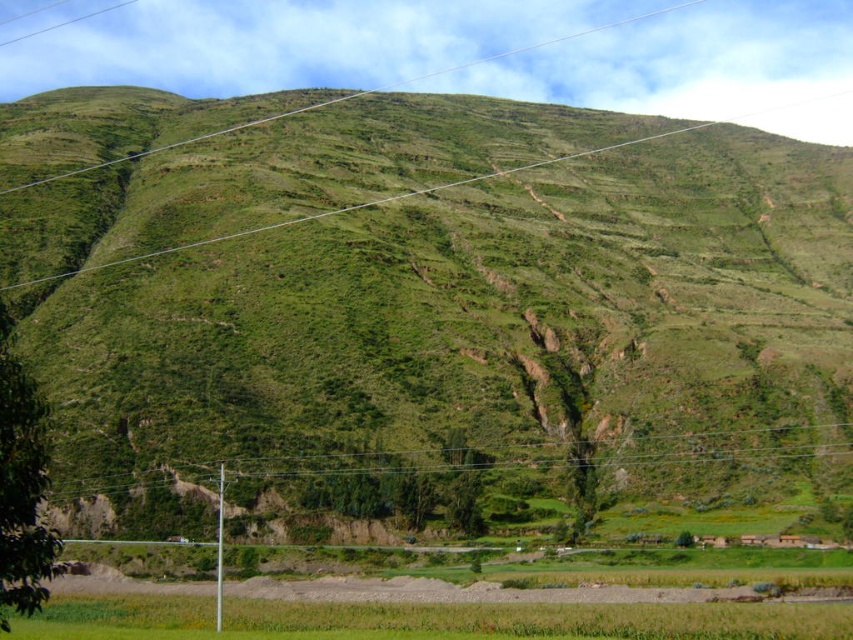
Question: Is green grassy rice field at lower center further to camera compared to green wire at center?

Choices:
 (A) yes
 (B) no

Answer: (B)

Question: In this image, where is green grassy rice field at lower center located relative to green wire at center?

Choices:
 (A) right
 (B) left

Answer: (B)

Question: Which is nearer to the green grassy rice field at lower center?

Choices:
 (A) green grassy hillside at center
 (B) green wire at center

Answer: (B)

Question: Which point appears farthest from the camera in this image?

Choices:
 (A) (96, 259)
 (B) (112, 480)
 (C) (245, 625)

Answer: (A)

Question: Based on their relative distances, which object is farther from the green grassy rice field at lower center?

Choices:
 (A) green wire at center
 (B) green grassy hillside at center

Answer: (B)

Question: Can you confirm if green grassy rice field at lower center is positioned to the left of green wire at center?

Choices:
 (A) yes
 (B) no

Answer: (A)